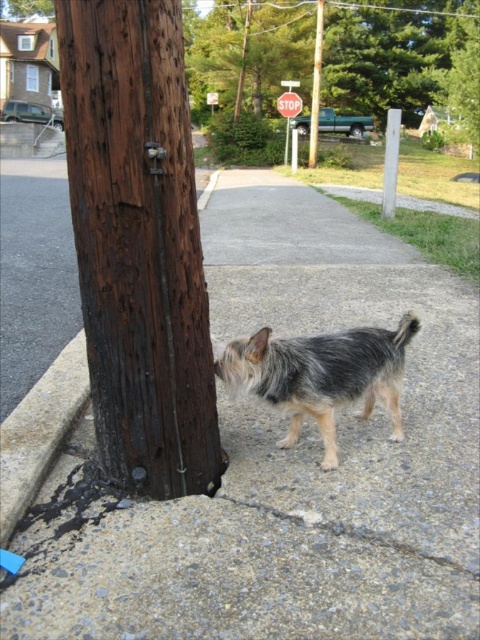
Question: Which point is closer to the camera?

Choices:
 (A) (387, 113)
 (B) (23, 600)

Answer: (B)

Question: Is gray concrete pavement at lower center positioned before fuzzy gray dog at lower center?

Choices:
 (A) yes
 (B) no

Answer: (B)

Question: Is gray concrete pavement at lower center closer to camera compared to green leafy tree at upper center?

Choices:
 (A) yes
 (B) no

Answer: (A)

Question: Which point is farther to the camera?

Choices:
 (A) (425, 122)
 (B) (389, 132)
 (C) (310, 342)

Answer: (A)

Question: Can you confirm if white smooth pole at center is thinner than brown wooden pole at center?

Choices:
 (A) no
 (B) yes

Answer: (A)

Question: Which point appears closest to the camera in this image?

Choices:
 (A) (430, 122)
 (B) (72, 184)
 (C) (392, 160)

Answer: (B)